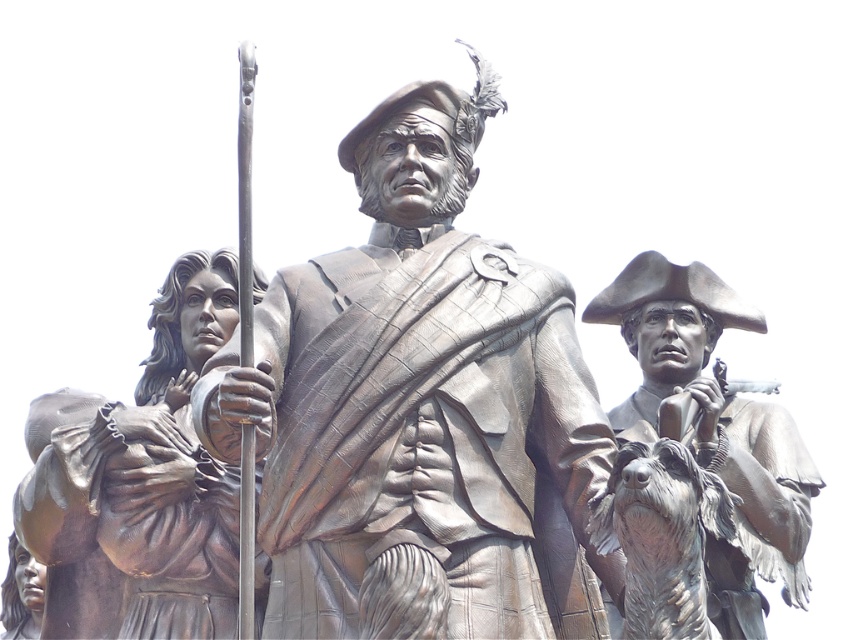
Question: Among these objects, which one is nearest to the camera?

Choices:
 (A) bronze statue at right
 (B) bronze statue at center
 (C) bronze statue at left

Answer: (B)

Question: Can you confirm if bronze statue at center is smaller than bronze statue at right?

Choices:
 (A) no
 (B) yes

Answer: (A)

Question: Is bronze statue at center positioned before bronze statue at right?

Choices:
 (A) yes
 (B) no

Answer: (A)

Question: Estimate the real-world distances between objects in this image. Which object is farther from the bronze statue at center?

Choices:
 (A) bronze statue at left
 (B) bronze statue at right

Answer: (B)

Question: Which object is the farthest from the bronze statue at center?

Choices:
 (A) bronze statue at right
 (B) bronze statue at left

Answer: (A)

Question: Can you confirm if bronze statue at center is positioned above bronze statue at left?

Choices:
 (A) no
 (B) yes

Answer: (B)